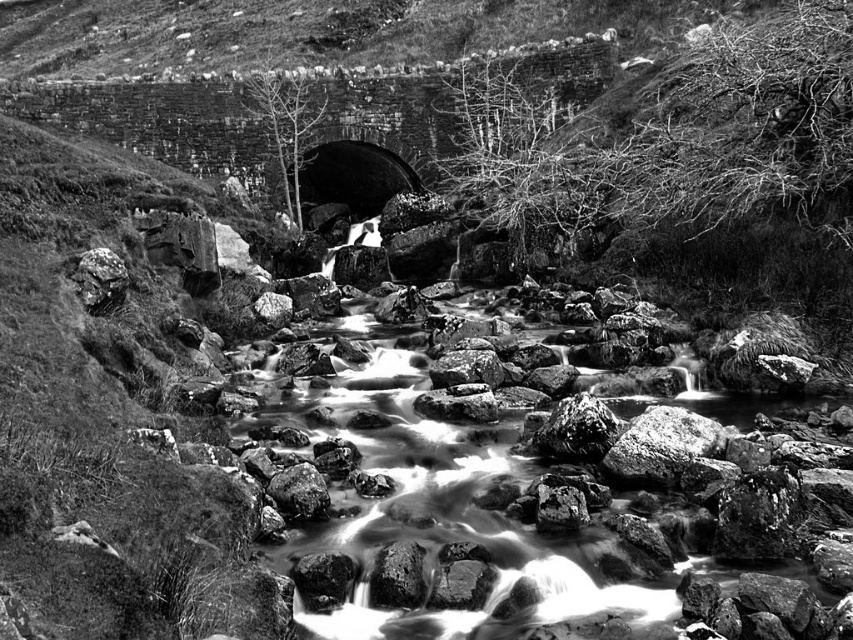
Which is behind, point (119, 280) or point (315, 472)?

The point (119, 280) is behind.

Can you confirm if rough textured rock at upper left is smaller than rough textured rock at center?

Yes, rough textured rock at upper left is smaller than rough textured rock at center.

Is point (86, 301) positioned after point (309, 486)?

That is True.

The image size is (853, 640). In order to click on rough textured rock at upper left in this screenshot , I will do click(x=100, y=280).